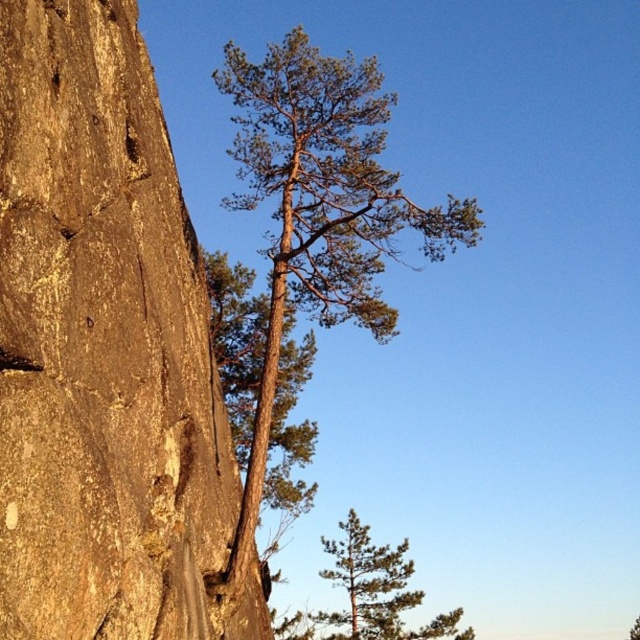
The image size is (640, 640). What do you see at coordinates (104, 349) in the screenshot? I see `brown rough rock at left` at bounding box center [104, 349].

Who is more forward, (145, 365) or (390, 596)?

Point (145, 365) is in front.

This screenshot has height=640, width=640. In order to click on brown rough rock at left in this screenshot , I will do `click(104, 349)`.

From the picture: Which is more to the right, green needle-like foliage at center or green needle-like tree at lower center?

green needle-like foliage at center

Is green needle-like foliage at center bigger than green needle-like tree at lower center?

Correct, green needle-like foliage at center is larger in size than green needle-like tree at lower center.

Which is in front, point (312, 138) or point (339, 570)?

Point (312, 138) is in front.

Locate an element on the screen. This screenshot has height=640, width=640. green needle-like foliage at center is located at coordinates (317, 212).

Is brown rough rock at left wider than green needle-like foliage at center?

No.

Is brown rough rock at left to the left of green needle-like foliage at center from the viewer's perspective?

Correct, you'll find brown rough rock at left to the left of green needle-like foliage at center.

I want to click on brown rough rock at left, so tap(104, 349).

The image size is (640, 640). Identify the location of brown rough rock at left. (104, 349).